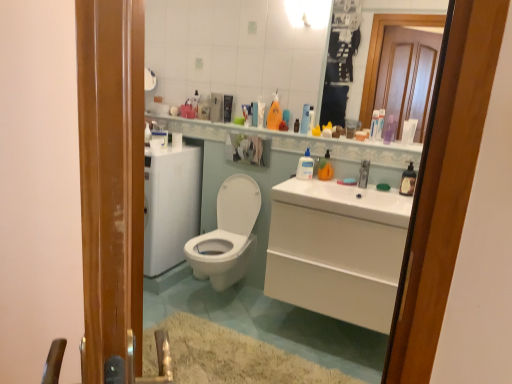
At what (x,y) coordinates should I click in order to perform the action: click on vacant space situated on the left part of matte plastic bottle at upper center, marked as the 1th toiletry in a left-to-right arrangement. Please return your answer as a coordinate pair (x, y). Image resolution: width=512 pixels, height=384 pixels. Looking at the image, I should click on tap(226, 122).